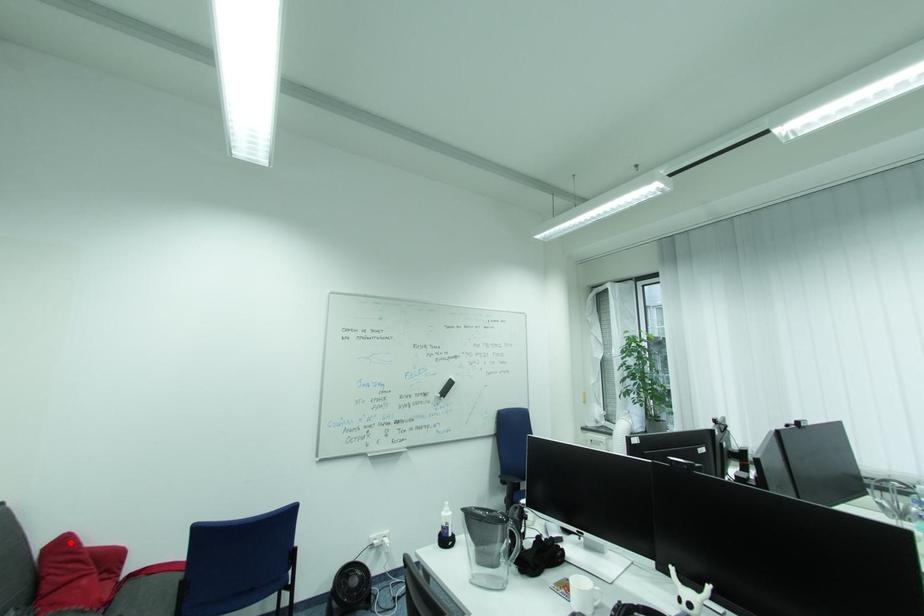
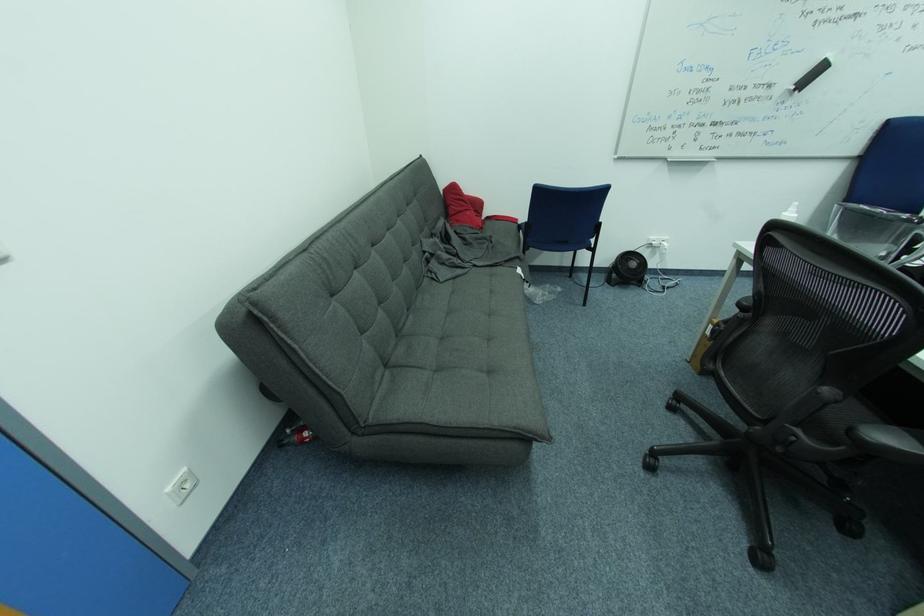
Locate, in the second image, the point that corresponds to the highlighted location in the first image.

(459, 188)